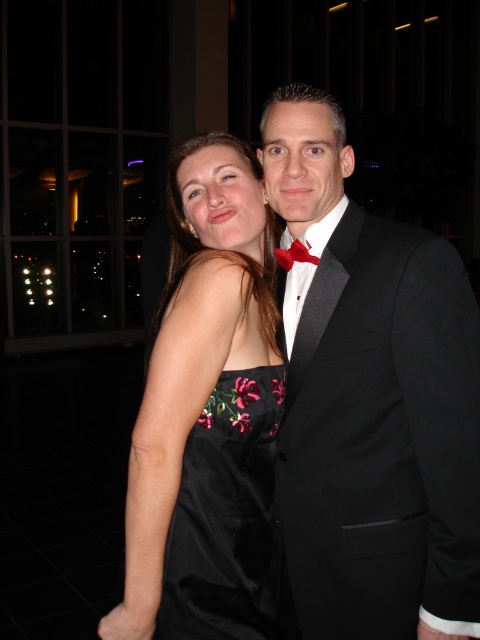
You are a photographer setting up for a close portrait of the two people in the image. You need to ensure that the black satin tuxedo at center and the matte black bow tie at center are both in focus. Given that your camera has a depth of field that can cover objects within 14 inches of each other, will both items be in focus?

The distance between the black satin tuxedo at center and the matte black bow tie at center is 14.31 inches. Since the camera can cover objects within 14 inches, the distance slightly exceeds the depth of field range. Therefore, both items may not be fully in focus.